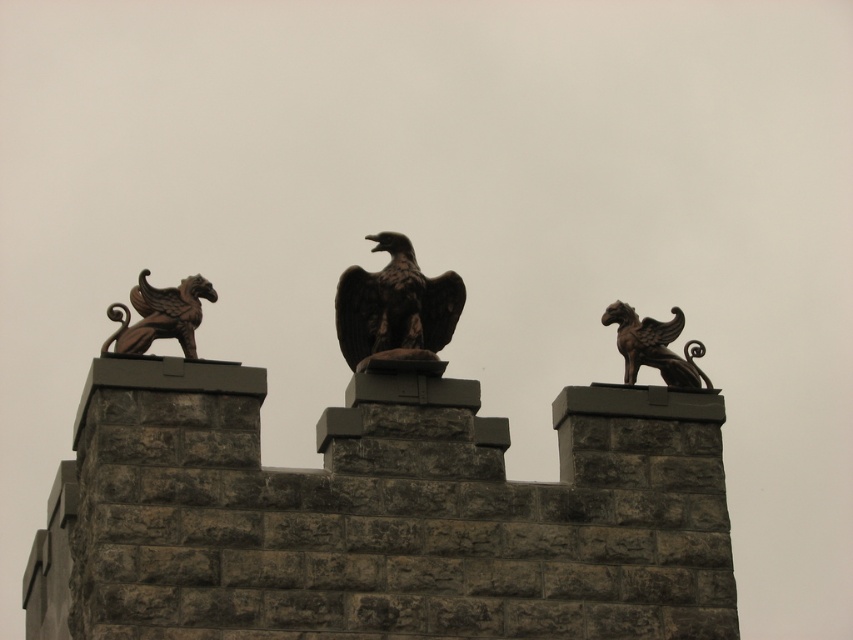
You are an architect examining the stone structure. You need to place a protective covering over the bronze gargoyle at left and the dark brown stone eagle at center. Based on their positions, which statue is closer to the left edge of the structure?

The bronze gargoyle at left is closer to the left edge of the structure because it is positioned to the left of the dark brown stone eagle at center.

You are an architect assessing the structural integrity of the stone blocks. Considering the weight distribution, which statue, the bronze gargoyle at left or the bronze gryphon at right, might pose a greater risk of causing the stone block to tilt due to its height?

The bronze gargoyle at left is much taller than the bronze gryphon at right, so it might pose a greater risk of causing the stone block to tilt due to its height.